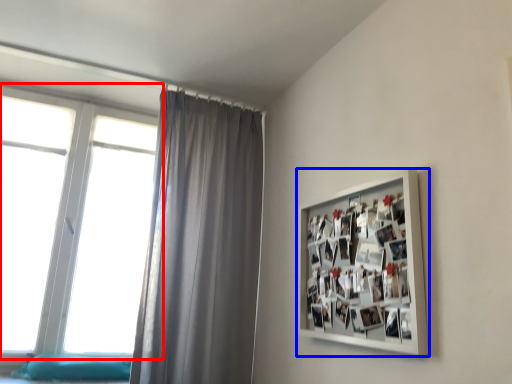
Question: Which object is further to the camera taking this photo, window (highlighted by a red box) or picture frame (highlighted by a blue box)?

Choices:
 (A) window
 (B) picture frame

Answer: (A)